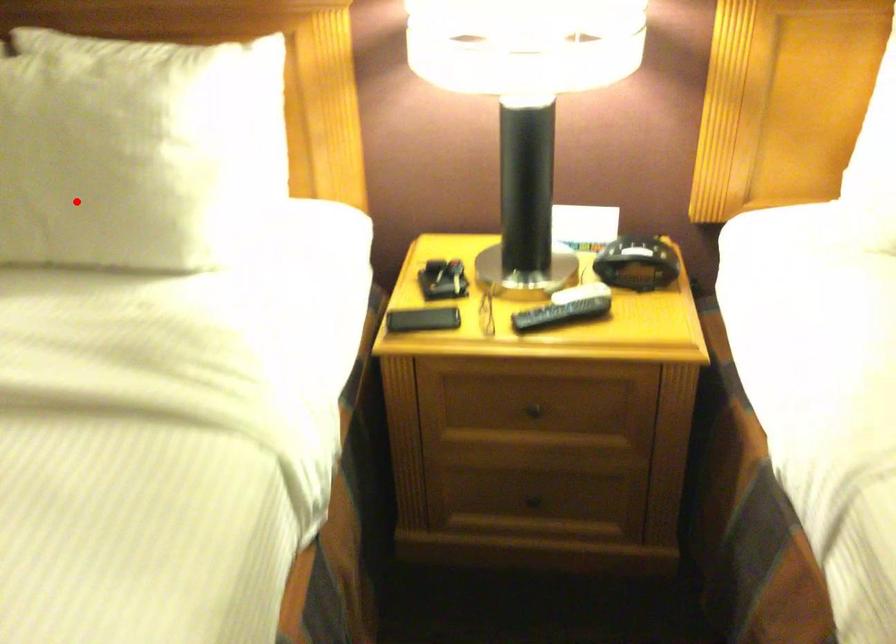
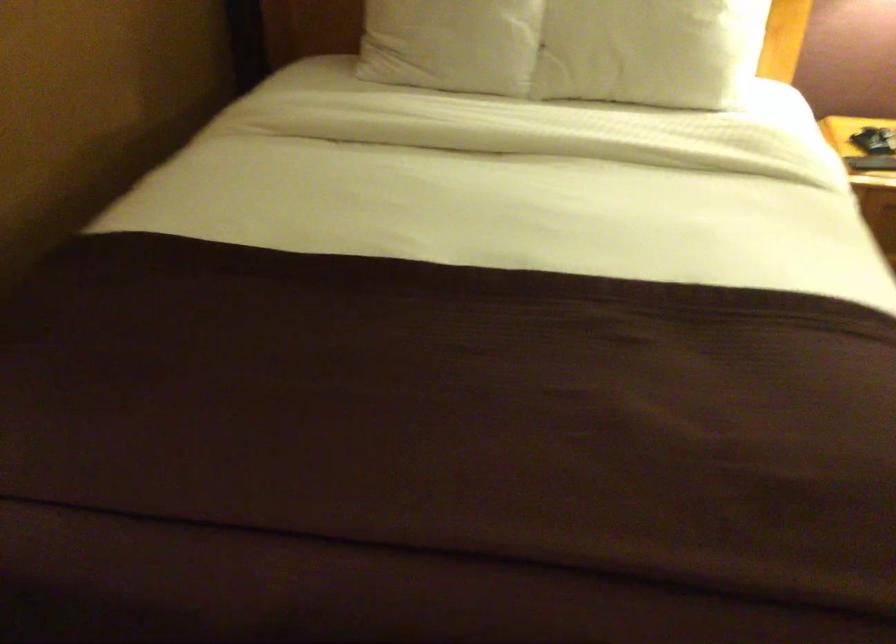
Question: A red point is marked in image1. In image2, is the corresponding 3D point closer to the camera or farther? Reply with the corresponding letter.

Choices:
 (A) The corresponding 3D point is closer.
 (B) The corresponding 3D point is farther.

Answer: (B)